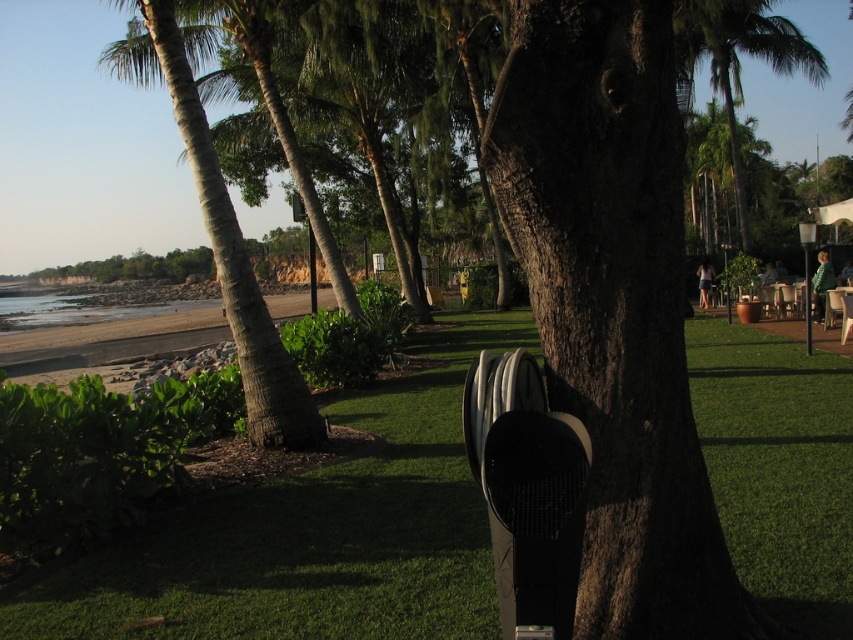
You are at the beach and want to sit on the white plastic beach chair at center. Which direction should you move relative to the green grass at center to reach it?

You should move to the left relative to the green grass at center to reach the white plastic beach chair at center because the green grass at center is located to the right of the white plastic beach chair at center.

You are standing in the coastal scene and want to place a small flag at each of the two points labeled point (769, 502) and point (740, 189). Which point is closer to you where you should place the flag first?

Point (769, 502) is closer to the viewer than point (740, 189), so you should place the flag there first.